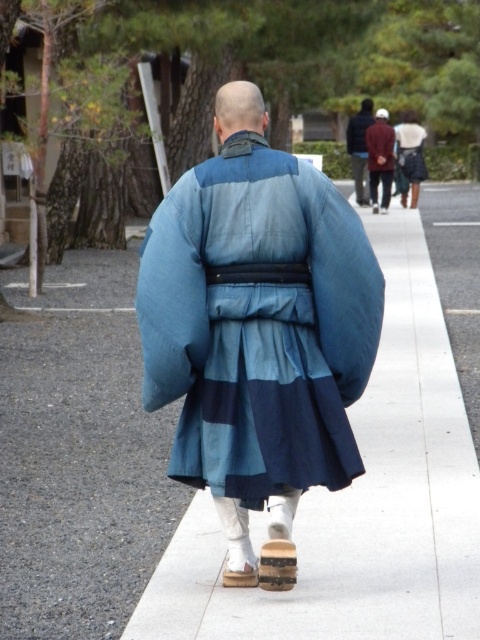
You are standing at the starting point of the pathway and want to follow the person in the blue silk kimono at center. Which direction should you walk to stay on the white concrete sidewalk at center while following them?

Since the white concrete sidewalk at center is behind the blue silk kimono at center, you should walk forward in the direction the person is moving to stay on the sidewalk. The sidewalk is positioned behind the kimono, so following the person while staying on the sidewalk requires moving forward along the path.